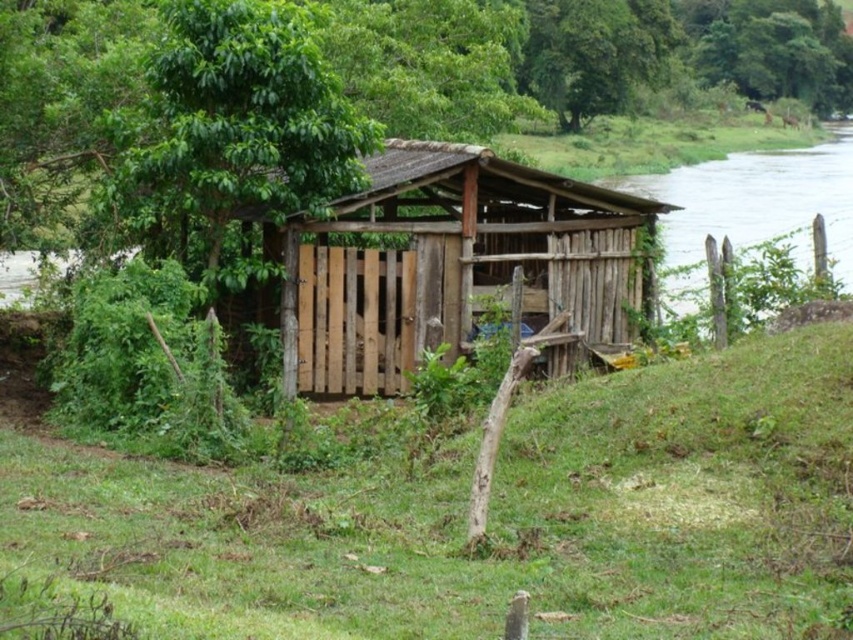
Question: Which of the following is the closest to the observer?

Choices:
 (A) (341, 209)
 (B) (764, 433)

Answer: (B)

Question: Is wooden shack at center below clear water at right?

Choices:
 (A) no
 (B) yes

Answer: (B)

Question: Is green grassy at center to the right of wooden shack at center from the viewer's perspective?

Choices:
 (A) no
 (B) yes

Answer: (B)

Question: Among these objects, which one is nearest to the camera?

Choices:
 (A) green grassy at center
 (B) wooden shack at center
 (C) clear water at right

Answer: (A)

Question: Does wooden shack at center have a larger size compared to clear water at right?

Choices:
 (A) no
 (B) yes

Answer: (A)

Question: Among these points, which one is nearest to the camera?

Choices:
 (A) (846, 246)
 (B) (486, 616)

Answer: (B)